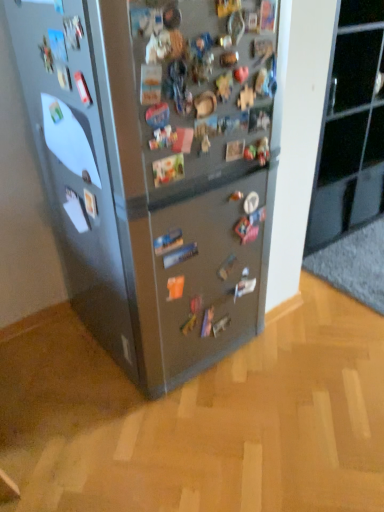
This screenshot has height=512, width=384. What do you see at coordinates (350, 128) in the screenshot?
I see `glossy black cabinet at upper right` at bounding box center [350, 128].

At what (x,y) coordinates should I click in order to perform the action: click on glossy black cabinet at upper right. Please return your answer as a coordinate pair (x, y). The width and height of the screenshot is (384, 512). Looking at the image, I should click on (350, 128).

Image resolution: width=384 pixels, height=512 pixels. What do you see at coordinates (158, 168) in the screenshot? I see `satin silver fridge at center` at bounding box center [158, 168].

Measure the distance between point (217, 189) and camera.

The distance of point (217, 189) from camera is 1.29 meters.

I want to click on satin silver fridge at center, so click(x=158, y=168).

Measure the distance between satin silver fridge at center and camera.

satin silver fridge at center and camera are 34.24 inches apart.

The height and width of the screenshot is (512, 384). Identify the location of glossy black cabinet at upper right. (350, 128).

Which object is positioned more to the left, glossy black cabinet at upper right or satin silver fridge at center?

From the viewer's perspective, satin silver fridge at center appears more on the left side.

Is glossy black cabinet at upper right closer to the viewer compared to satin silver fridge at center?

No, glossy black cabinet at upper right is further to the viewer.

Considering the points (366, 8) and (163, 73), which point is behind, point (366, 8) or point (163, 73)?

The point (366, 8) is farther from the camera.

From the image's perspective, is glossy black cabinet at upper right positioned above or below satin silver fridge at center?

Based on their image positions, glossy black cabinet at upper right is located above satin silver fridge at center.

From a real-world perspective, is glossy black cabinet at upper right located beneath satin silver fridge at center?

Yes, from a real-world perspective, glossy black cabinet at upper right is beneath satin silver fridge at center.

Between glossy black cabinet at upper right and satin silver fridge at center, which one has larger width?

Wider between the two is satin silver fridge at center.

Does glossy black cabinet at upper right have a greater height compared to satin silver fridge at center?

Incorrect, the height of glossy black cabinet at upper right is not larger of that of satin silver fridge at center.

Between glossy black cabinet at upper right and satin silver fridge at center, which one has smaller size?

Smaller between the two is glossy black cabinet at upper right.

Is glossy black cabinet at upper right completely or partially outside of satin silver fridge at center?

Yes.

Is glossy black cabinet at upper right touching satin silver fridge at center?

glossy black cabinet at upper right and satin silver fridge at center are not in contact.

Is glossy black cabinet at upper right oriented towards satin silver fridge at center?

No, glossy black cabinet at upper right is not facing towards satin silver fridge at center.

How distant is glossy black cabinet at upper right from satin silver fridge at center?

glossy black cabinet at upper right and satin silver fridge at center are 1.01 meters apart from each other.

Locate an element on the screen. refrigerator above the glossy black cabinet at upper right (from a real-world perspective) is located at coordinates (158, 168).

Which object is positioned more to the right, satin silver fridge at center or glossy black cabinet at upper right?

From the viewer's perspective, glossy black cabinet at upper right appears more on the right side.

Which is behind, satin silver fridge at center or glossy black cabinet at upper right?

Positioned behind is glossy black cabinet at upper right.

Between point (154, 82) and point (321, 172), which one is positioned in front?

The point (154, 82) is closer to the camera.

From the image's perspective, is satin silver fridge at center positioned above or below glossy black cabinet at upper right?

From the image's perspective, satin silver fridge at center appears below glossy black cabinet at upper right.

From a real-world perspective, is satin silver fridge at center above or below glossy black cabinet at upper right?

Clearly, from a real-world perspective, satin silver fridge at center is above glossy black cabinet at upper right.

Which object is wider, satin silver fridge at center or glossy black cabinet at upper right?

Wider between the two is satin silver fridge at center.

Is satin silver fridge at center taller than glossy black cabinet at upper right?

Yes.

Looking at this image, is satin silver fridge at center smaller than glossy black cabinet at upper right?

No, satin silver fridge at center is not smaller than glossy black cabinet at upper right.

Does satin silver fridge at center contain glossy black cabinet at upper right?

No, glossy black cabinet at upper right is located outside of satin silver fridge at center.

Is there a large distance between satin silver fridge at center and glossy black cabinet at upper right?

Absolutely, satin silver fridge at center is distant from glossy black cabinet at upper right.

Is satin silver fridge at center looking in the opposite direction of glossy black cabinet at upper right?

No, glossy black cabinet at upper right is not at the back of satin silver fridge at center.

Can you tell me how much satin silver fridge at center and glossy black cabinet at upper right differ in facing direction?

0.316 degrees separate the facing orientations of satin silver fridge at center and glossy black cabinet at upper right.

How distant is satin silver fridge at center from glossy black cabinet at upper right?

They are 3.30 feet apart.

In order to click on refrigerator in front of the glossy black cabinet at upper right in this screenshot , I will do `click(158, 168)`.

This screenshot has height=512, width=384. I want to click on cabinetry on the right side of satin silver fridge at center, so click(x=350, y=128).

In the image, there is a satin silver fridge at center. Where is `cabinetry above it (from the image's perspective)`? cabinetry above it (from the image's perspective) is located at coordinates (350, 128).